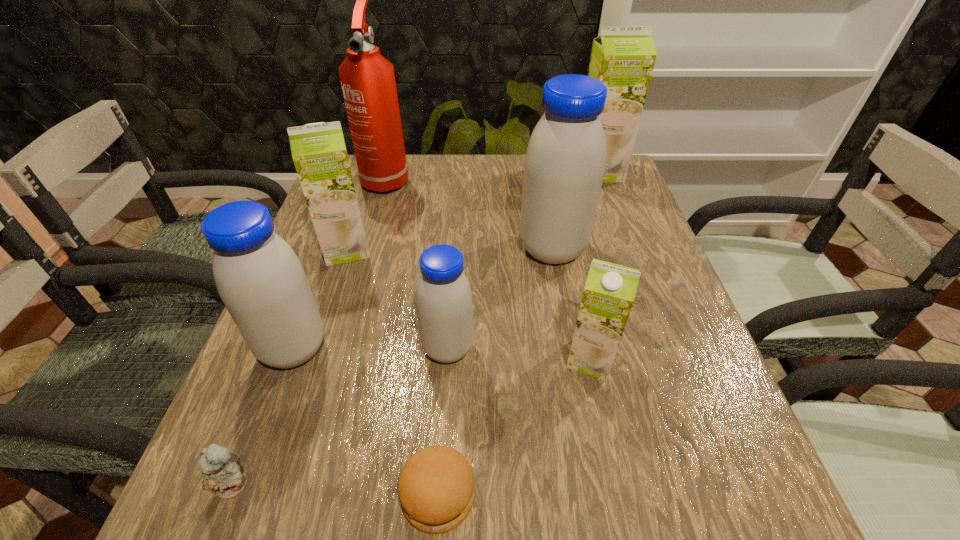
The image size is (960, 540). Find the location of `vacant space located 0.140m on the front of the leftmost blue soya milk`. vacant space located 0.140m on the front of the leftmost blue soya milk is located at coordinates [x=253, y=457].

Where is `vacant area situated 0.170m on the back of the second green soya milk from left to right`? The height and width of the screenshot is (540, 960). vacant area situated 0.170m on the back of the second green soya milk from left to right is located at coordinates (572, 275).

I want to click on vacant region located 0.050m on the front of the smallest blue soya milk, so click(x=444, y=395).

What are the coordinates of `free region located on the back of the shortest object` in the screenshot? It's located at (448, 338).

Identify the location of fire extinguisher present at the far edge. (368, 83).

Find the location of a particular element. soya milk positioned at the far edge is located at coordinates (622, 58).

This screenshot has width=960, height=540. Identify the location of teddy bear that is positioned at the near edge. (219, 474).

Find the location of a particular element. This screenshot has width=960, height=540. hamburger located at the near edge is located at coordinates (436, 490).

This screenshot has height=540, width=960. Find the location of `fire extinguisher at the left edge`. fire extinguisher at the left edge is located at coordinates (368, 83).

Locate an element on the screen. The width and height of the screenshot is (960, 540). teddy bear at the left edge is located at coordinates (219, 474).